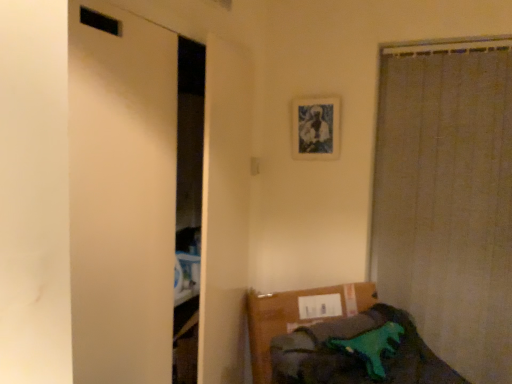
Locate an element on the screen. free point above beige textured curtain at right (from a real-world perspective) is located at coordinates (458, 49).